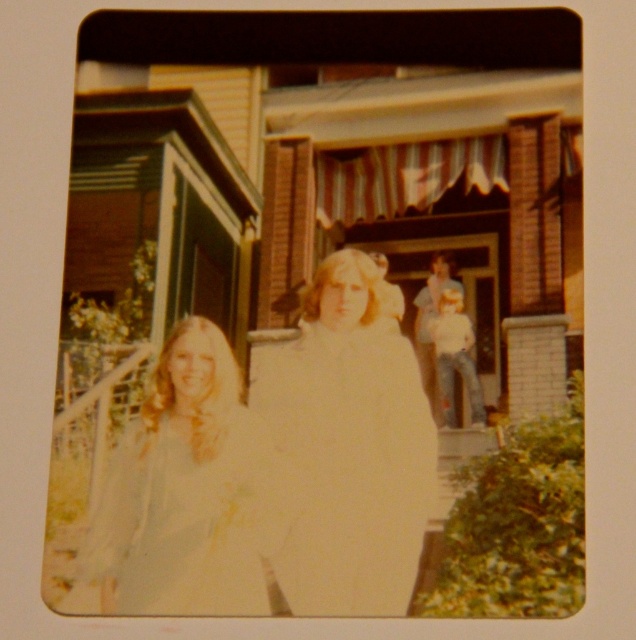
Is point (326, 486) more distant than point (200, 573)?

Yes.

Who is positioned more to the right, white cotton dress at center or light blue fabric dress at left?

From the viewer's perspective, white cotton dress at center appears more on the right side.

At what (x,y) coordinates should I click in order to perform the action: click on white cotton dress at center. Please return your answer as a coordinate pair (x, y). This screenshot has width=636, height=640. Looking at the image, I should click on (349, 445).